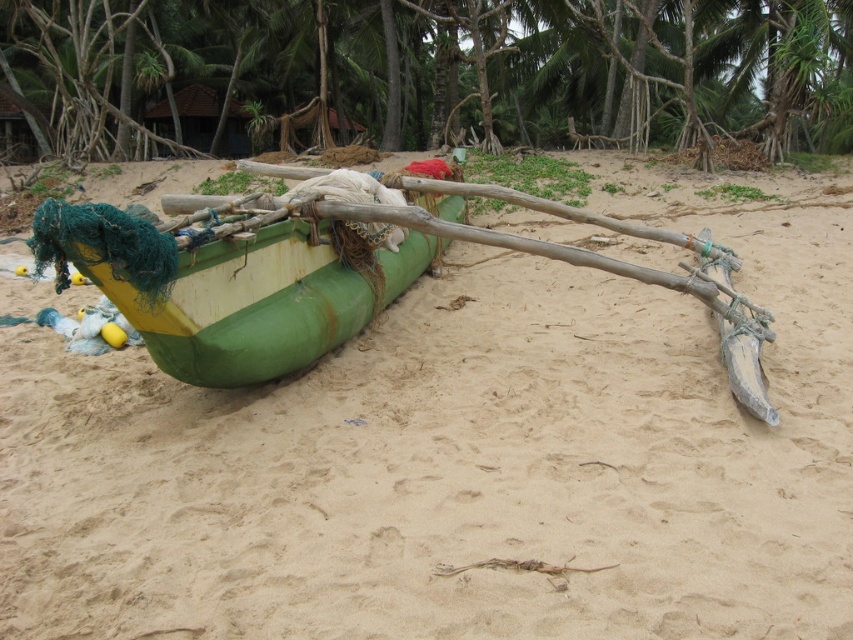
Question: Can you confirm if green leafy tree at upper center is bigger than green rubber boat at center?

Choices:
 (A) no
 (B) yes

Answer: (B)

Question: Among these points, which one is farthest from the camera?

Choices:
 (A) (421, 0)
 (B) (323, 221)

Answer: (A)

Question: Observing the image, what is the correct spatial positioning of green leafy tree at upper center in reference to green rubber boat at center?

Choices:
 (A) left
 (B) right

Answer: (A)

Question: Observing the image, what is the correct spatial positioning of green leafy tree at upper center in reference to green rubber boat at center?

Choices:
 (A) above
 (B) below

Answer: (A)